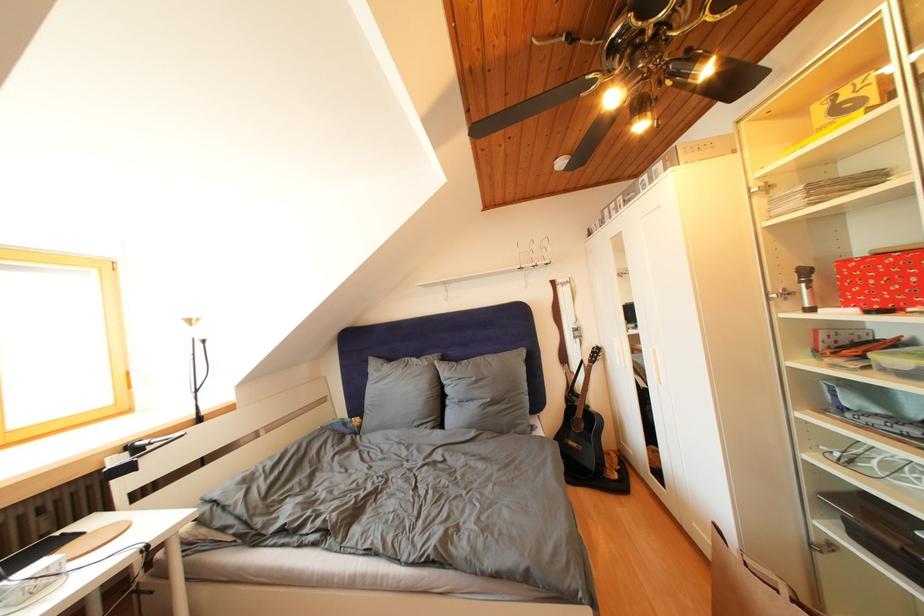
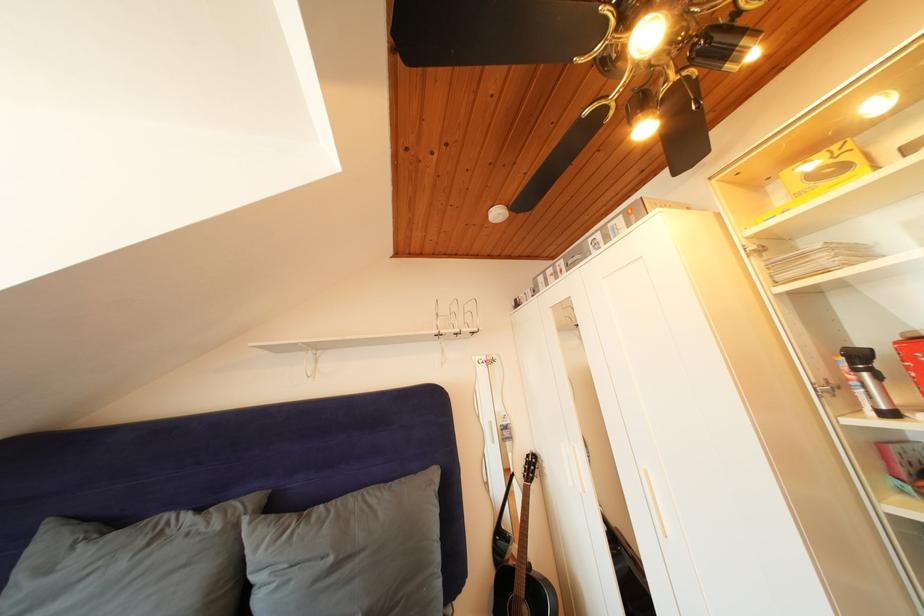
Question: What movement of the cameraman would produce the second image?

Choices:
 (A) Left
 (B) Right
 (C) Forward
 (D) Backward

Answer: (C)